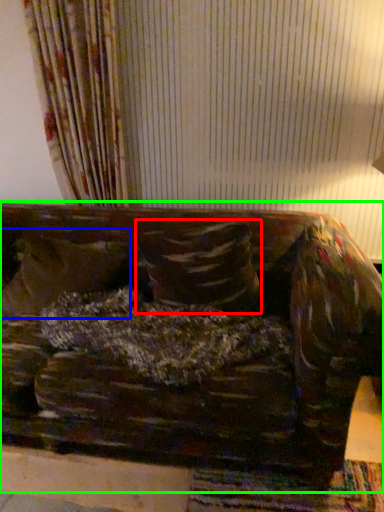
Question: Considering the real-world distances, which object is closest to pillow (highlighted by a red box)? pillow (highlighted by a blue box) or studio couch (highlighted by a green box).

Choices:
 (A) pillow
 (B) studio couch

Answer: (B)